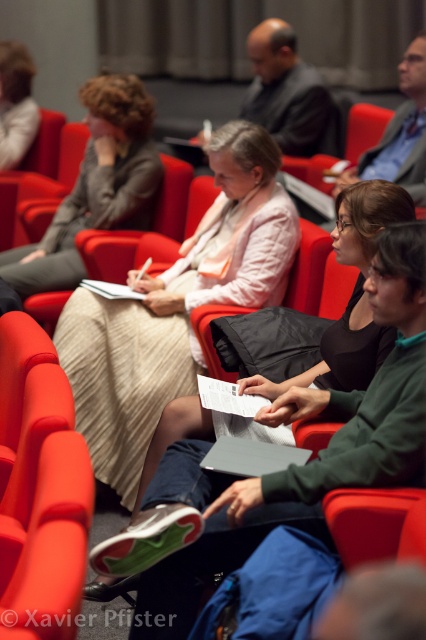
Question: From the image, what is the correct spatial relationship of light beige skirt at center in relation to white fabric shirt at upper left?

Choices:
 (A) above
 (B) below

Answer: (B)

Question: Considering the real-world distances, which object is farthest from the white fabric shirt at upper left?

Choices:
 (A) matte black jacket at center
 (B) matte gray blazer at upper left
 (C) matte red chair at center

Answer: (A)

Question: Is matte black jacket at center above white fabric shirt at upper left?

Choices:
 (A) no
 (B) yes

Answer: (A)

Question: Which of these objects is positioned closest to the light beige skirt at center?

Choices:
 (A) matte gray blazer at upper left
 (B) matte black jacket at center
 (C) white fabric shirt at upper left
 (D) matte red chair at center

Answer: (D)

Question: Is matte red chair at center below white fabric shirt at upper left?

Choices:
 (A) yes
 (B) no

Answer: (A)

Question: Which of the following is the farthest from the observer?

Choices:
 (A) (281, 387)
 (B) (135, 253)
 (C) (405, 102)

Answer: (C)